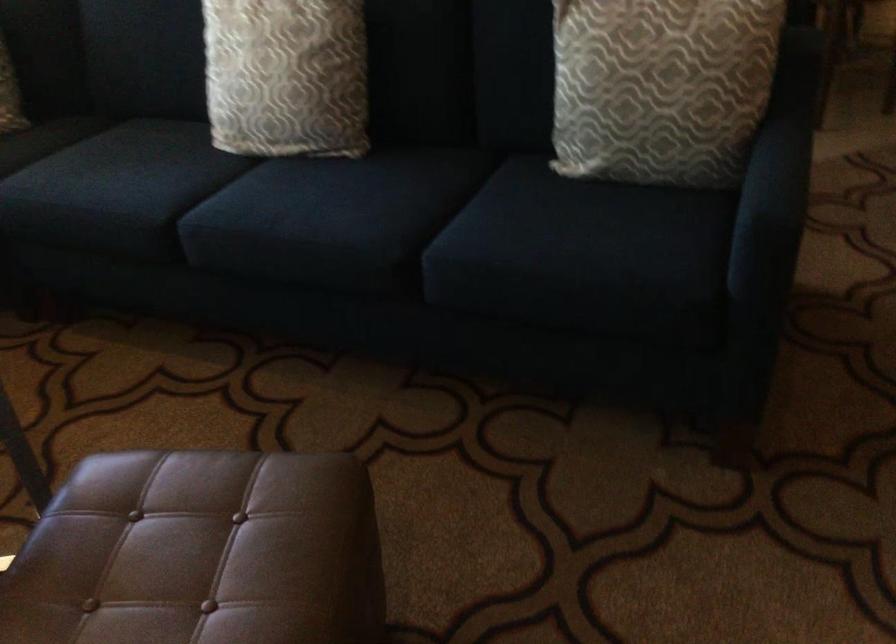
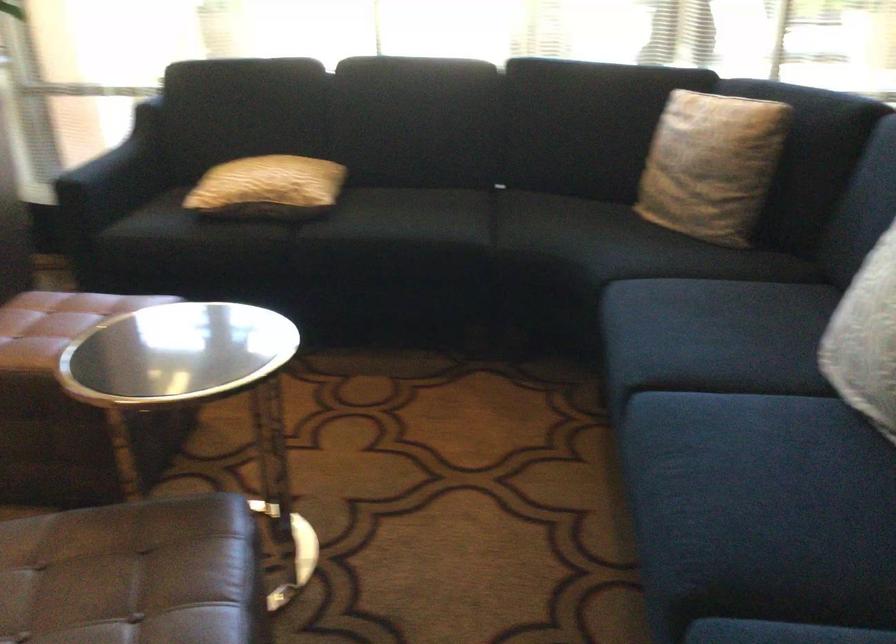
Where in the second image is the point corresponding to point (306, 203) from the first image?

(745, 459)